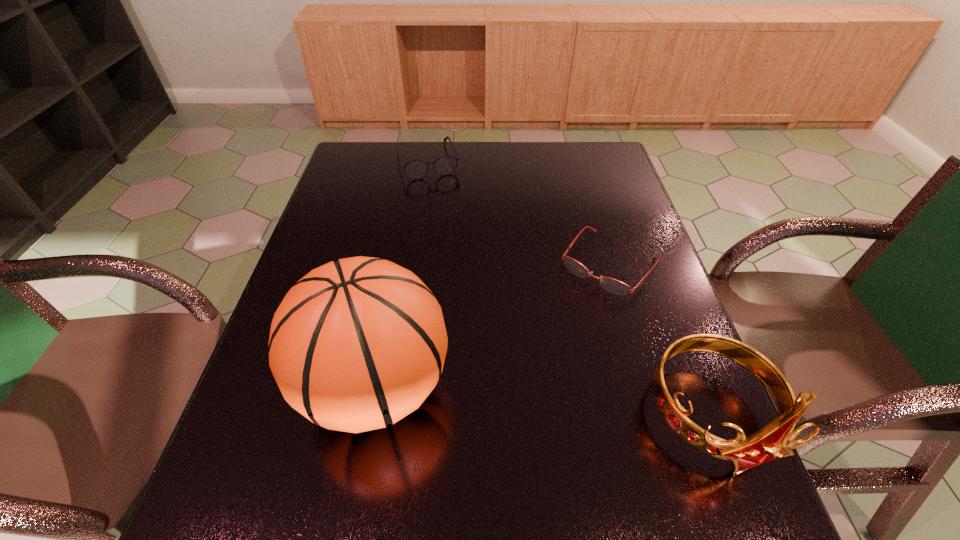
Identify the location of object that is at the near right corner. (775, 440).

The width and height of the screenshot is (960, 540). Find the location of `vacant area at the far edge`. vacant area at the far edge is located at coordinates (391, 176).

Find the location of `vacant region at the near edge of the desktop`. vacant region at the near edge of the desktop is located at coordinates click(x=642, y=461).

The width and height of the screenshot is (960, 540). Identify the location of vacant area at the left edge. (256, 392).

Identify the location of free space at the right edge of the desktop. (591, 207).

The height and width of the screenshot is (540, 960). Identify the location of free space at the near left corner of the desktop. (286, 431).

This screenshot has width=960, height=540. What are the coordinates of `empty space that is in between the farthest object and the shortest object` in the screenshot? It's located at (518, 212).

What are the coordinates of `unoccupied area between the shortest object and the tiara` in the screenshot? It's located at (660, 340).

This screenshot has height=540, width=960. I want to click on empty space between the basketball and the right spectacles, so click(492, 325).

Find the location of a particular element. This screenshot has width=960, height=540. empty location between the tiara and the basketball is located at coordinates (543, 402).